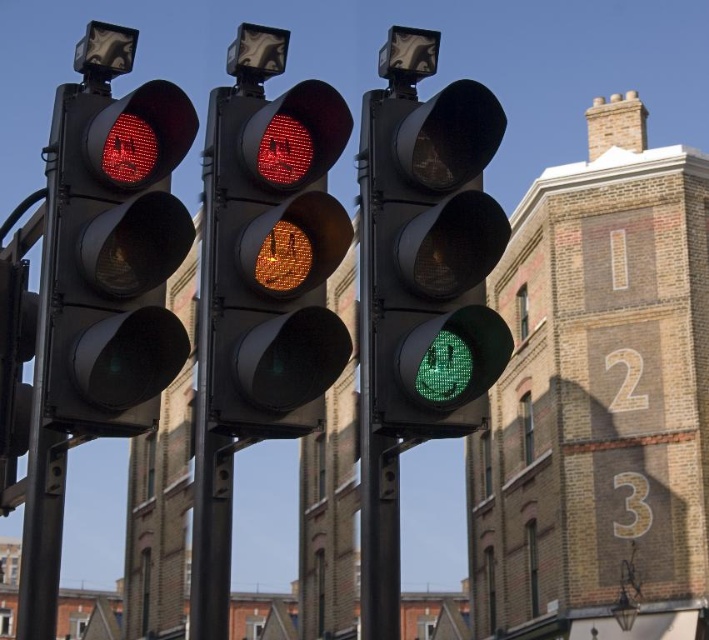
Can you confirm if matte glass traffic light at center is bigger than green matte traffic light at center?

Yes.

Between matte glass traffic light at center and green matte traffic light at center, which one has less height?

Standing shorter between the two is matte glass traffic light at center.

The width and height of the screenshot is (709, 640). What are the coordinates of `matte glass traffic light at center` in the screenshot? It's located at (272, 259).

Who is more distant from viewer, [206,154] or [101,401]?

The point [206,154] is behind.

Who is shorter, matte glass traffic light at center or matte black traffic light at left?

With less height is matte glass traffic light at center.

Locate an element on the screen. matte glass traffic light at center is located at coordinates (272, 259).

Can you confirm if matte black traffic light at left is bigger than green matte traffic light at center?

Correct, matte black traffic light at left is larger in size than green matte traffic light at center.

Who is taller, matte black traffic light at left or green matte traffic light at center?

matte black traffic light at left

What do you see at coordinates (113, 257) in the screenshot? The width and height of the screenshot is (709, 640). I see `matte black traffic light at left` at bounding box center [113, 257].

Where is `matte black traffic light at left`? The width and height of the screenshot is (709, 640). matte black traffic light at left is located at coordinates (113, 257).